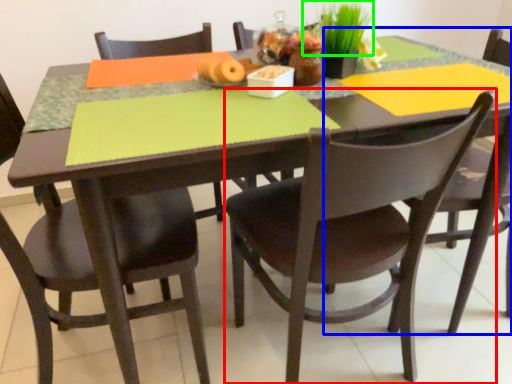
Question: Considering the real-world distances, which object is closest to chair (highlighted by a red box)? chair (highlighted by a blue box) or plant (highlighted by a green box).

Choices:
 (A) chair
 (B) plant

Answer: (A)